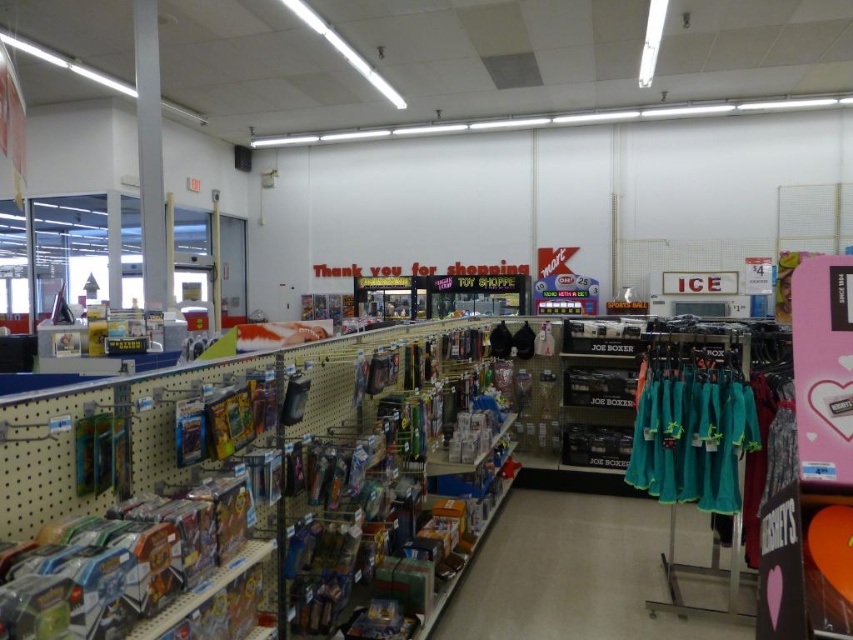
Locate an element on the screen. This screenshot has width=853, height=640. teal fabric clothing at center is located at coordinates (573, 573).